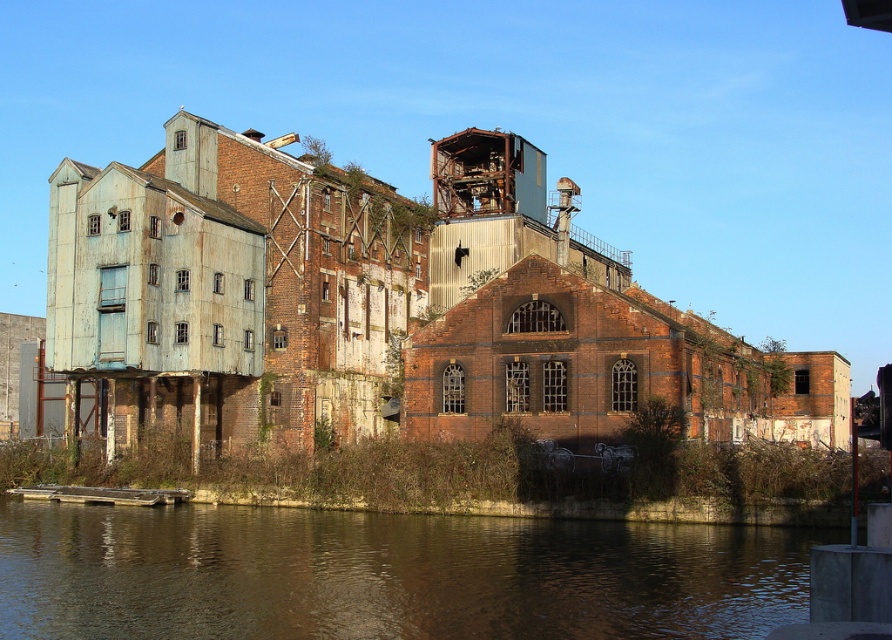
Can you confirm if rusty metal building at left is positioned below brown reflective water at lower left?

No.

Looking at this image, does rusty metal building at left have a lesser width compared to brown reflective water at lower left?

No.

Does point (775, 438) lie behind point (521, 620)?

Yes, it is.

This screenshot has width=892, height=640. What are the coordinates of `rusty metal building at left` in the screenshot? It's located at (395, 301).